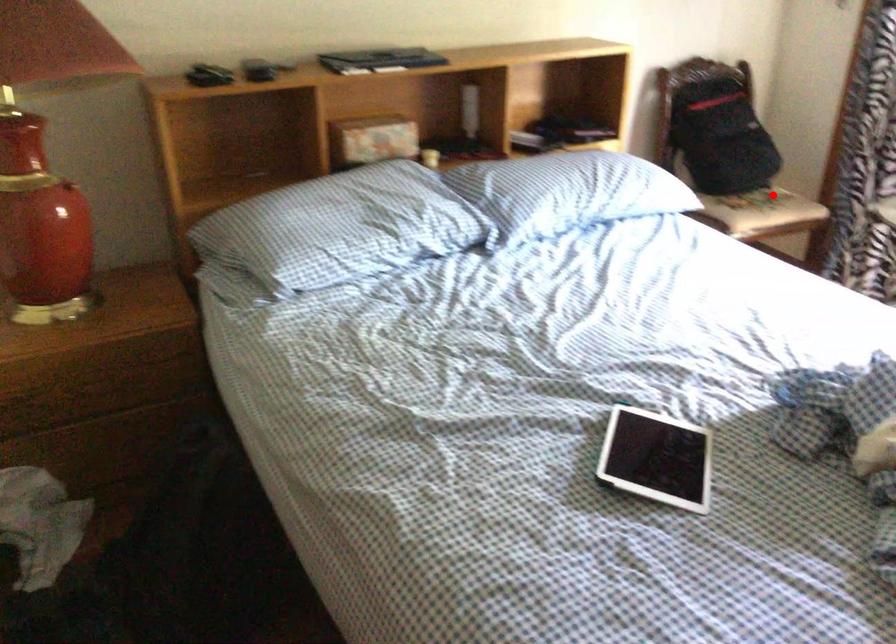
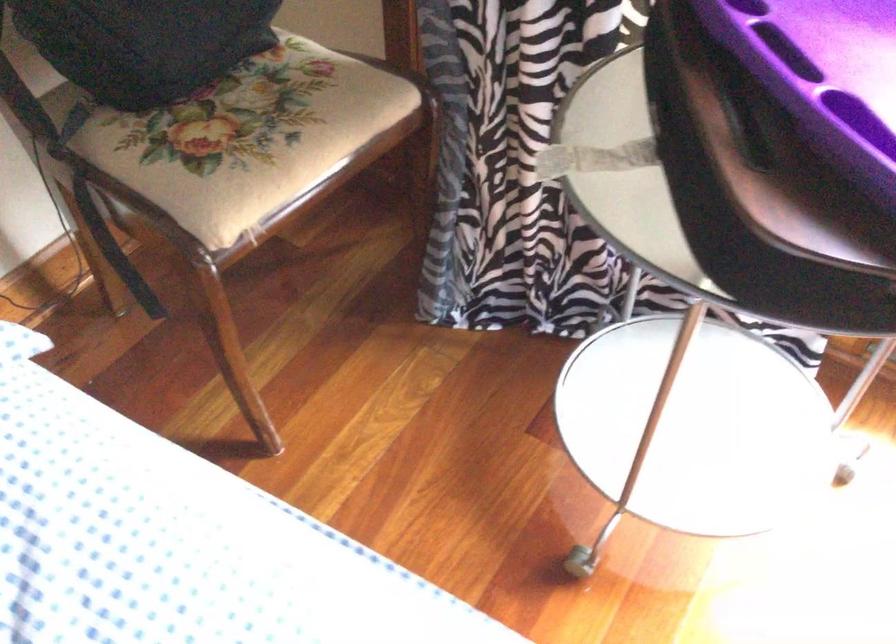
In the second image, find the point that corresponds to the highlighted location in the first image.

(259, 145)